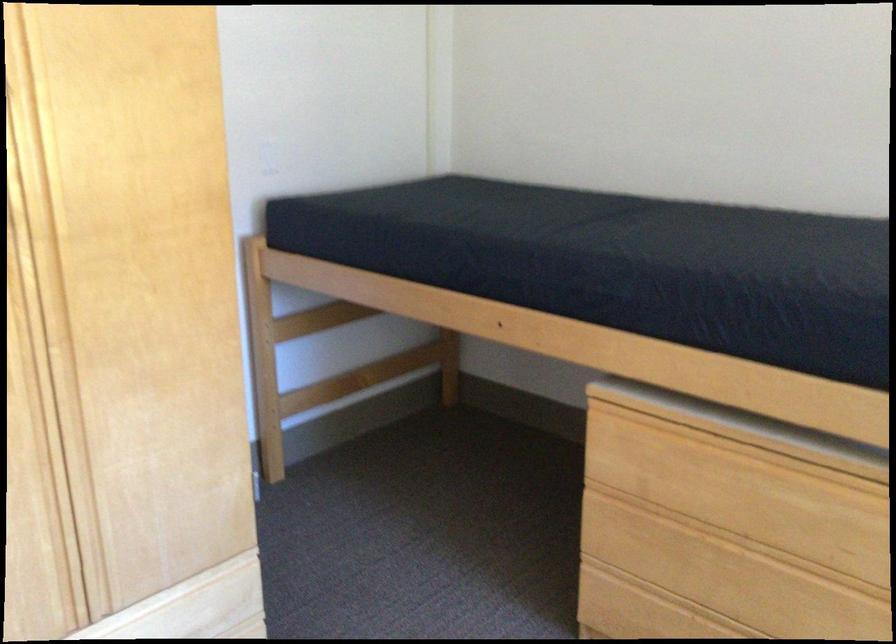
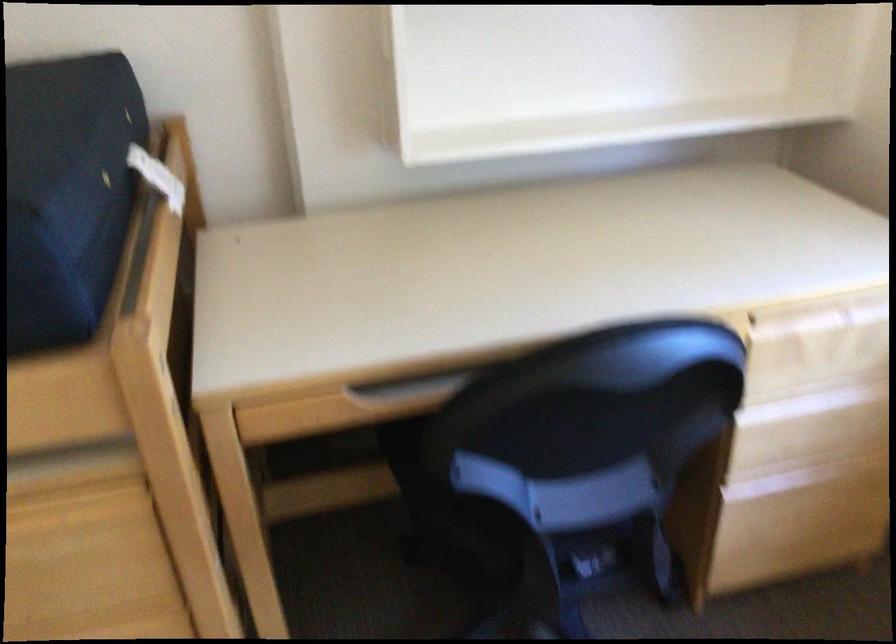
Based on the continuous images, in which direction is the camera rotating?

The camera rotated toward right-down.